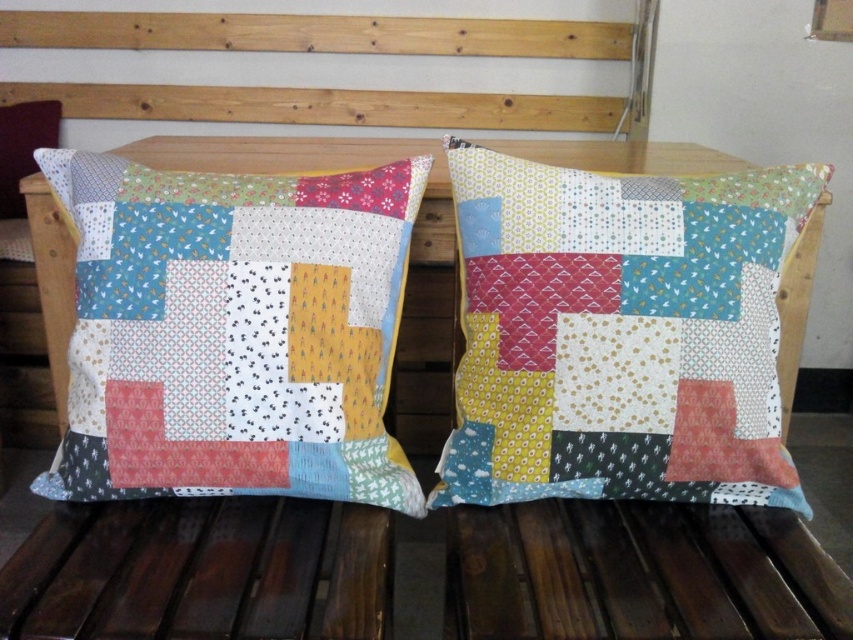
Is patchwork fabric pillow at center in front of patchwork fabric pillow at left?

No, patchwork fabric pillow at center is behind patchwork fabric pillow at left.

Is point (567, 225) positioned in front of point (369, 268)?

That is True.

I want to click on patchwork fabric pillow at center, so coord(619,333).

Where is `patchwork fabric pillow at center`? This screenshot has width=853, height=640. patchwork fabric pillow at center is located at coordinates (619, 333).